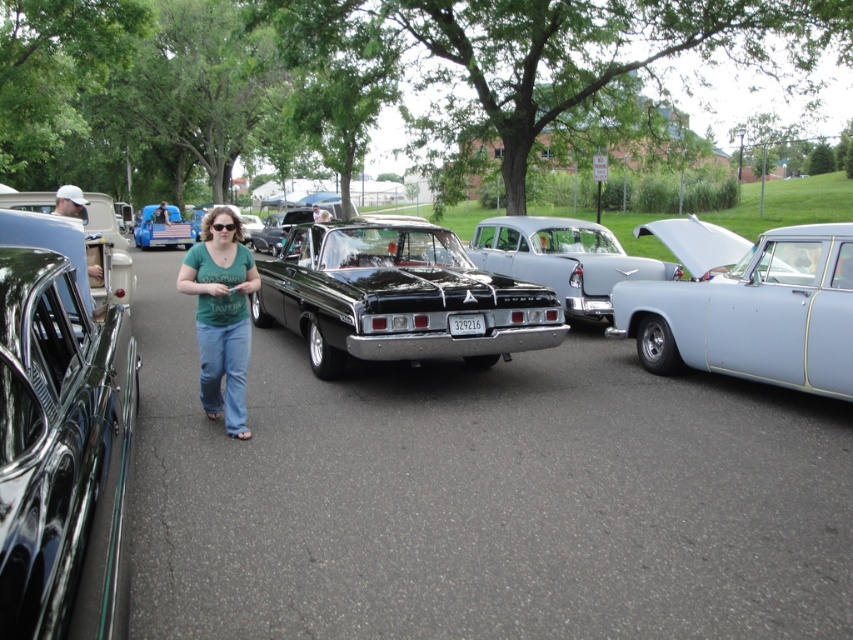
How distant is light blue metallic car at right from matte black car at center?

light blue metallic car at right and matte black car at center are 9.27 feet apart from each other.

Between point (805, 364) and point (608, 292), which one is positioned behind?

The point (608, 292) is behind.

Between point (677, 314) and point (517, 275), which one is positioned behind?

The point (517, 275) is behind.

Image resolution: width=853 pixels, height=640 pixels. Identify the location of light blue metallic car at right. (749, 307).

Which is above, matte black car at center or green t-shirt at center?

matte black car at center is higher up.

Is matte black car at center bigger than green t-shirt at center?

Yes, matte black car at center is bigger than green t-shirt at center.

What do you see at coordinates (563, 259) in the screenshot?
I see `matte black car at center` at bounding box center [563, 259].

This screenshot has height=640, width=853. Find the location of `matte black car at center`. matte black car at center is located at coordinates coord(563,259).

What do you see at coordinates (397, 298) in the screenshot? I see `black glossy car at center` at bounding box center [397, 298].

Is black glossy car at center closer to camera compared to matte blue truck at center?

Yes, black glossy car at center is closer to the viewer.

Find the location of a particular element. Image resolution: width=853 pixels, height=640 pixels. black glossy car at center is located at coordinates (397, 298).

Where is `black glossy car at center`? black glossy car at center is located at coordinates (397, 298).